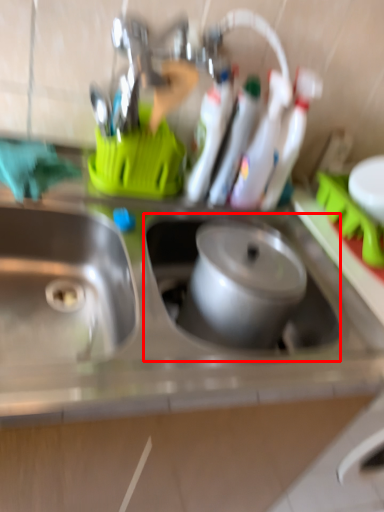
Question: From the image, what is the correct spatial relationship of sink (annotated by the red box) in relation to sink?

Choices:
 (A) right
 (B) left

Answer: (A)